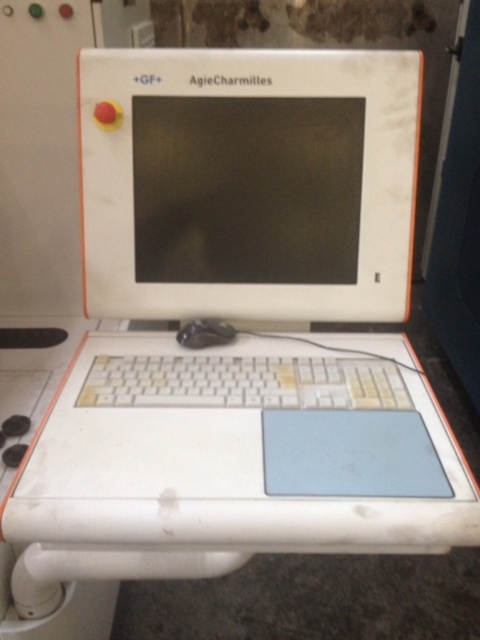
You are an engineer inspecting the AgieCharmilles control panel. You notice two points on the panel at coordinates point (x=196, y=177) and point (x=194, y=616). Which point is nearer to your viewpoint as you face the panel?

Point (x=196, y=177) is closer to the camera than point (x=194, y=616), so the point at (x=196, y=177) is nearer to your viewpoint.

You are an engineer inspecting the control panel of an AgieCharmilles machine. You notice two points marked on the panel at coordinates point (225, 396) and point (233, 336). Which point is closer to you?

Point (225, 396) is closer to the viewer than point (233, 336).